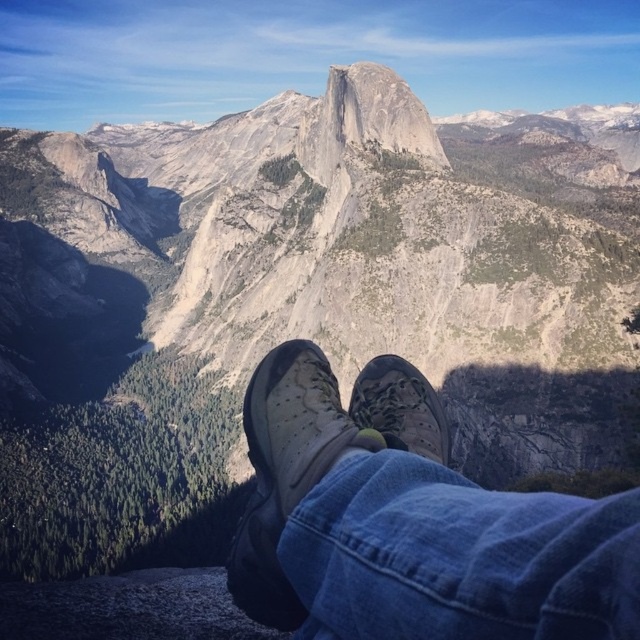
You are a hiker who just reached the edge of the cliff and wants to take a photo of the mountain view. You have two shoes in front of you, a leather textured shoe at center and a camouflage fabric shoe at center. Which shoe should you move to the right side to avoid blocking the view of the mountain peak?

You should move the camouflage fabric shoe at center to the right side because the leather textured shoe at center is already to the left of it, so moving the rightmost shoe would keep the left shoe in place and avoid blocking the mountain peak.

You are a hiker who wants to place a GPS marker at the exact center of the image. You have two objects in the scene to reference for positioning. The objects are the worn leather shoes at center and the rugged granite peak. Which object should you use as a reference point to ensure the GPS marker is placed correctly?

The rugged granite peak is the focal point dominating the center of the frame, so using it as a reference point would ensure the GPS marker is placed at the exact center of the image.